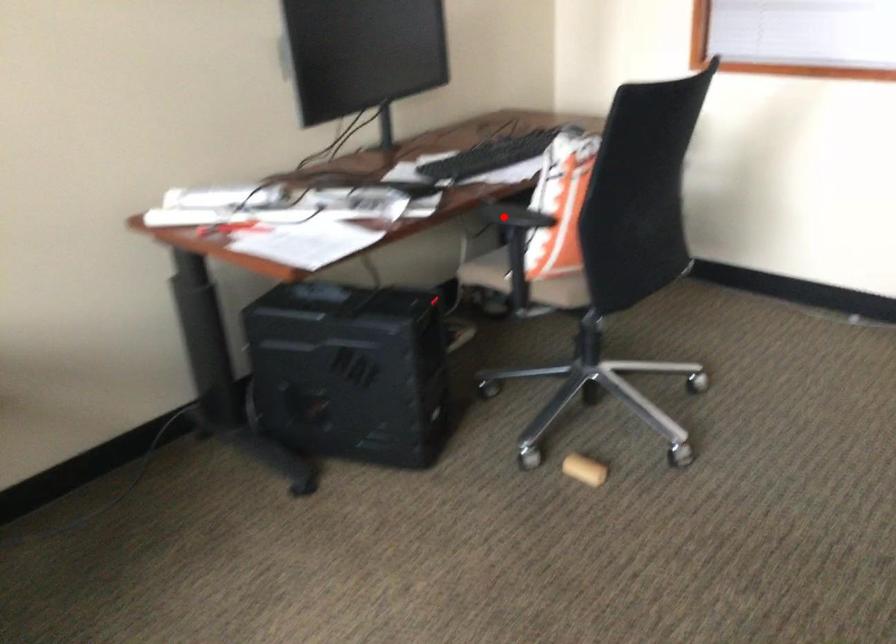
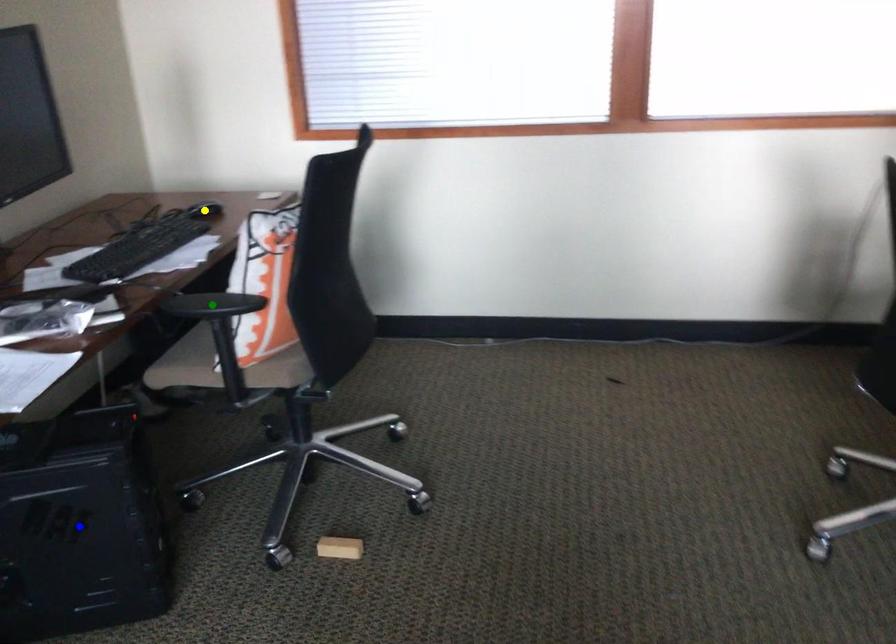
Question: I am providing you with two images of the same scene from different viewpoints. A red point is marked on the first image. You are given multiple points on the second image. Which point in image 2 is actually the same real-world point as the red point in image 1?

Choices:
 (A) blue point
 (B) yellow point
 (C) green point

Answer: (C)